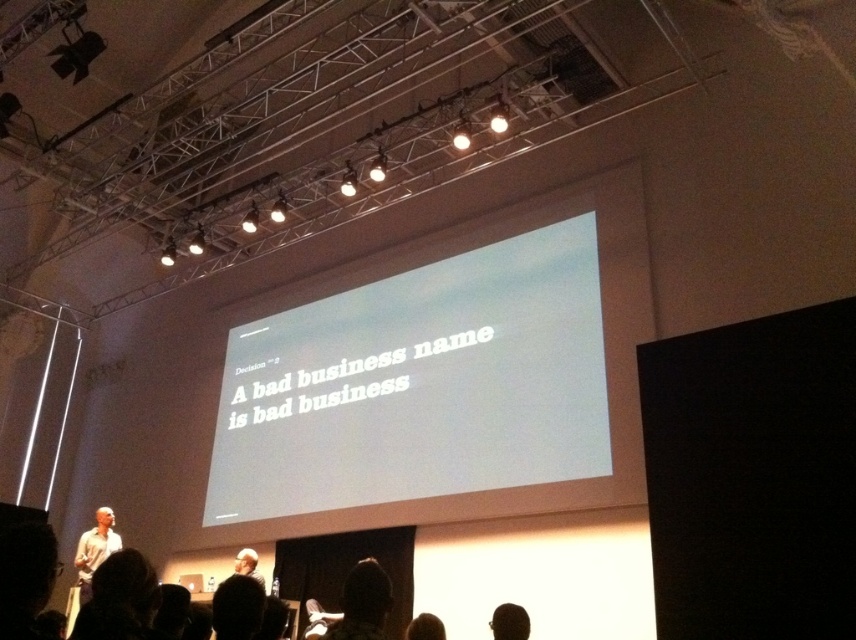
Is point (103, 589) closer to viewer compared to point (348, 579)?

Yes.

Which is below, light brown hair at lower left or dark hair at lower center?

Positioned lower is dark hair at lower center.

Identify the location of light brown hair at lower left. (117, 598).

This screenshot has height=640, width=856. Find the location of `light brown hair at lower left`. light brown hair at lower left is located at coordinates (117, 598).

Is dark hair at lower center below brown hair at lower center?

Actually, dark hair at lower center is above brown hair at lower center.

Which is behind, point (369, 598) or point (443, 628)?

Positioned behind is point (443, 628).

Who is more forward, (361,602) or (423,632)?

Positioned in front is point (361,602).

At what (x,y) coordinates should I click in order to perform the action: click on dark hair at lower center. Please return your answer as a coordinate pair (x, y). The image size is (856, 640). Looking at the image, I should click on (361, 604).

Which is in front, point (513, 612) or point (263, 586)?

Point (513, 612) is in front.

Describe the element at coordinates (509, 621) in the screenshot. This screenshot has width=856, height=640. I see `dark brown hair at lower center` at that location.

What do you see at coordinates (509, 621) in the screenshot? Image resolution: width=856 pixels, height=640 pixels. I see `dark brown hair at lower center` at bounding box center [509, 621].

I want to click on dark brown hair at lower center, so click(509, 621).